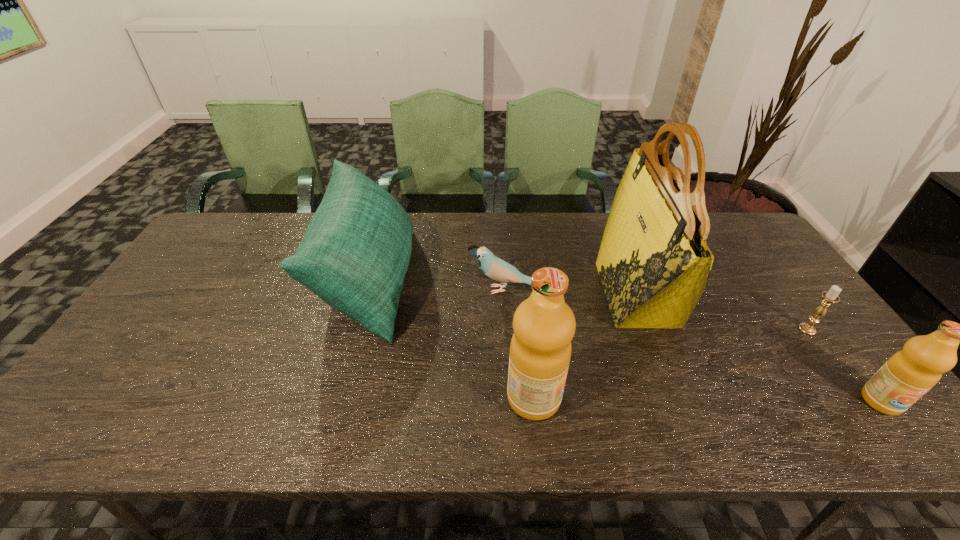
I want to click on unoccupied position between the tallest object and the fifth shortest object, so click(x=585, y=346).

You are a GUI agent. You are given a task and a screenshot of the screen. Output one action in this format:
    pyautogui.click(x=<x>, y=<y>)
    Task: Click on the free space between the left fruit juice and the candle holder
    The height and width of the screenshot is (540, 960).
    Given the screenshot: What is the action you would take?
    pyautogui.click(x=670, y=364)

Where is `free point between the shorter fruit juice and the left fruit juice`? free point between the shorter fruit juice and the left fruit juice is located at coordinates (708, 400).

This screenshot has width=960, height=540. Identify the location of object that ranks as the fifth closest to the tallest object. (354, 256).

Identify the location of object that is the fourth closest to the shorter fruit juice. The image size is (960, 540). (497, 269).

The image size is (960, 540). In order to click on free space in the image that satisfies the following two spatial constraints: 1. on the front-facing side of the candle holder; 2. on the left side of the leftmost object in this screenshot , I will do `click(355, 329)`.

Where is `vacant space that satisfies the following two spatial constraints: 1. on the front side of the candle holder; 2. on the front label of the left fruit juice`? The image size is (960, 540). vacant space that satisfies the following two spatial constraints: 1. on the front side of the candle holder; 2. on the front label of the left fruit juice is located at coordinates pos(857,398).

This screenshot has height=540, width=960. In order to click on vacant area in the image that satisfies the following two spatial constraints: 1. at the face of the bird; 2. on the right side of the candle holder in this screenshot , I will do `click(509, 329)`.

Image resolution: width=960 pixels, height=540 pixels. In order to click on free point that satisfies the following two spatial constraints: 1. on the front-facing side of the candle holder; 2. on the left side of the tallest object in this screenshot , I will do `click(650, 329)`.